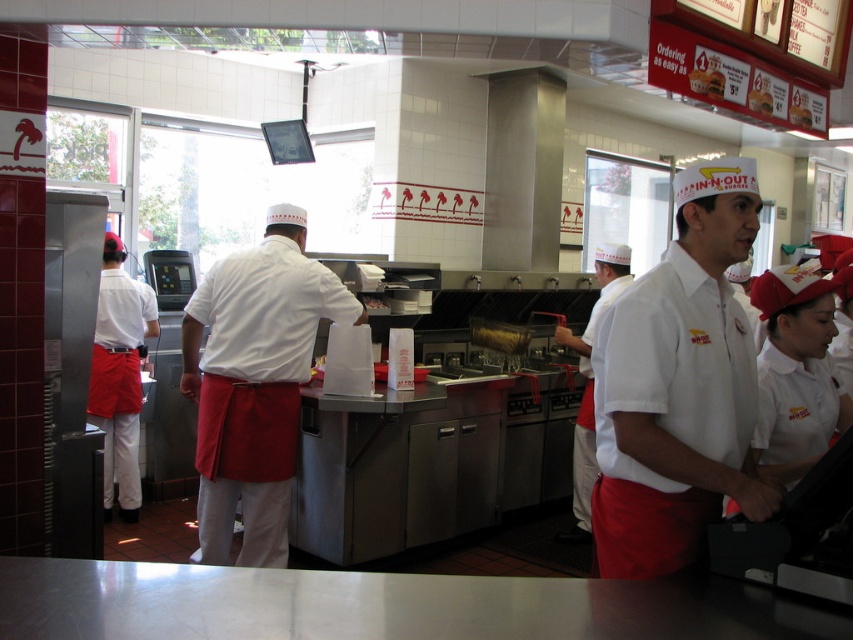
Question: Does white matte uniform at center have a smaller size compared to white cardboard box at center?

Choices:
 (A) yes
 (B) no

Answer: (B)

Question: Among these points, which one is nearest to the camera?

Choices:
 (A) (596, 273)
 (B) (291, 240)
 (C) (106, 316)
 (D) (509, 336)

Answer: (B)

Question: Can you confirm if white matte shirt at center is wider than white matte apron at center?

Choices:
 (A) no
 (B) yes

Answer: (A)

Question: Which object is the farthest from the matte red apron at left?

Choices:
 (A) brown leather wallet at center
 (B) white matte shirt at center
 (C) white matte apron at center
 (D) white matte uniform at center

Answer: (B)

Question: Which point is closer to the camera?

Choices:
 (A) (111, 404)
 (B) (207, 531)
 (C) (479, 328)
 (D) (378, 296)

Answer: (B)

Question: Is brown leather wallet at center above white cardboard box at center?

Choices:
 (A) yes
 (B) no

Answer: (B)